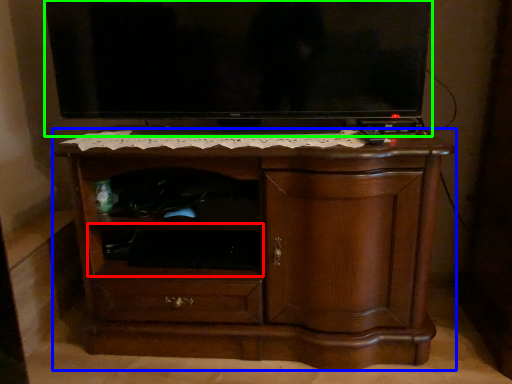
Question: Which object is positioned closest to shelf (highlighted by a red box)? Select from chest of drawers (highlighted by a blue box) and television (highlighted by a green box).

Choices:
 (A) chest of drawers
 (B) television

Answer: (A)